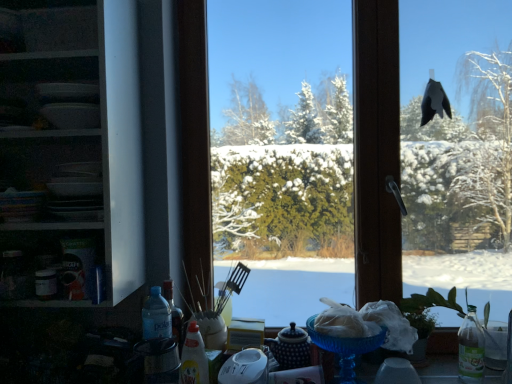
Question: Is blue glass bowl at lower center outside of translucent plastic bottle at center?

Choices:
 (A) no
 (B) yes

Answer: (B)

Question: Is blue glass bowl at lower center placed right next to translucent plastic bottle at center?

Choices:
 (A) no
 (B) yes

Answer: (A)

Question: Can you confirm if blue glass bowl at lower center is positioned to the right of translucent plastic bottle at center?

Choices:
 (A) no
 (B) yes

Answer: (B)

Question: Is blue glass bowl at lower center aimed at translucent plastic bottle at center?

Choices:
 (A) yes
 (B) no

Answer: (B)

Question: Considering the relative sizes of blue glass bowl at lower center and translucent plastic bottle at center in the image provided, is blue glass bowl at lower center bigger than translucent plastic bottle at center?

Choices:
 (A) no
 (B) yes

Answer: (B)

Question: From a real-world perspective, is blue glass bowl at lower center on top of translucent plastic bottle at center?

Choices:
 (A) no
 (B) yes

Answer: (A)

Question: Considering the relative sizes of translucent plastic bottle at center and white glossy shelves at left in the image provided, is translucent plastic bottle at center wider than white glossy shelves at left?

Choices:
 (A) yes
 (B) no

Answer: (B)

Question: From a real-world perspective, is translucent plastic bottle at center located higher than white glossy shelves at left?

Choices:
 (A) yes
 (B) no

Answer: (B)

Question: Is translucent plastic bottle at center aimed at white glossy shelves at left?

Choices:
 (A) yes
 (B) no

Answer: (B)

Question: Considering the relative sizes of translucent plastic bottle at center and white glossy shelves at left in the image provided, is translucent plastic bottle at center shorter than white glossy shelves at left?

Choices:
 (A) no
 (B) yes

Answer: (B)

Question: Can we say translucent plastic bottle at center lies outside white glossy shelves at left?

Choices:
 (A) no
 (B) yes

Answer: (B)

Question: Does translucent plastic bottle at center appear on the right side of white glossy shelves at left?

Choices:
 (A) no
 (B) yes

Answer: (B)

Question: Can you confirm if transparent glass window at center is bigger than white glossy shelves at left?

Choices:
 (A) yes
 (B) no

Answer: (B)